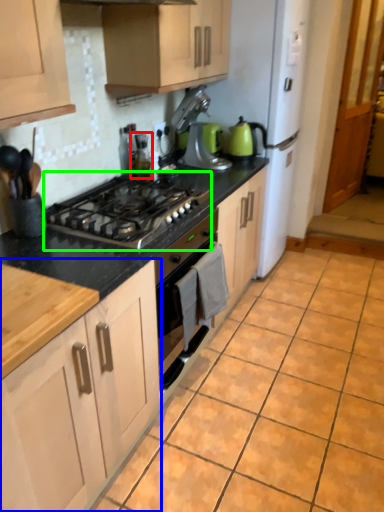
Question: Which is farther away from appliance (highlighted by a red box)? cabinetry (highlighted by a blue box) or gas stove (highlighted by a green box)?

Choices:
 (A) cabinetry
 (B) gas stove

Answer: (A)